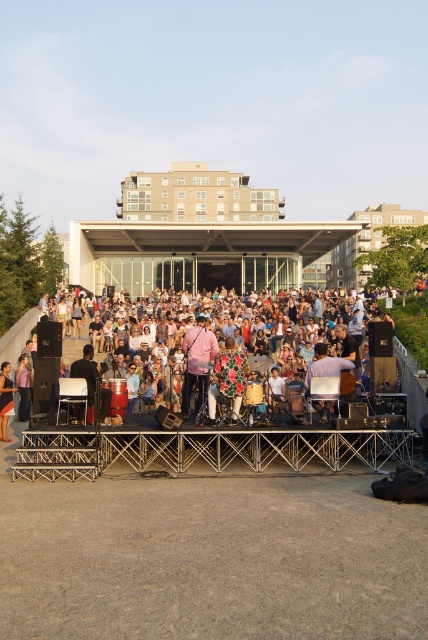
Question: Estimate the real-world distances between objects in this image. Which object is closer to the pink floral shirt at center?

Choices:
 (A) matte black jacket at lower left
 (B) light brown wooden chair at center

Answer: (A)

Question: Based on their relative distances, which object is farther from the pink cotton shirt at center?

Choices:
 (A) matte black jacket at lower left
 (B) matte black drum at center
 (C) floral fabric dress at center

Answer: (A)

Question: Which point is farther to the camera?

Choices:
 (A) (211, 332)
 (B) (92, 348)
 (C) (97, 289)
 (D) (187, 362)

Answer: (C)

Question: Is pink cotton shirt at center thinner than matte black drum at center?

Choices:
 (A) yes
 (B) no

Answer: (B)

Question: Can you confirm if beige concrete amphitheater at center is positioned below floral fabric dress at center?

Choices:
 (A) no
 (B) yes

Answer: (A)

Question: Is beige concrete amphitheater at center positioned in front of matte black drum at center?

Choices:
 (A) no
 (B) yes

Answer: (A)